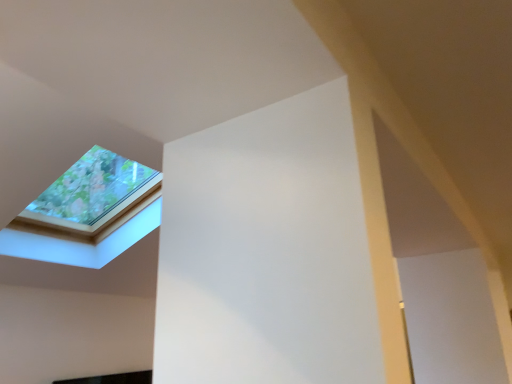
In order to face clear glass window at upper left, should I rotate leftwards or rightwards?

It's best to rotate left around 21.228 degrees.

At what (x,y) coordinates should I click in order to perform the action: click on clear glass window at upper left. Please return your answer as a coordinate pair (x, y). Looking at the image, I should click on (88, 213).

This screenshot has height=384, width=512. What do you see at coordinates (88, 213) in the screenshot?
I see `clear glass window at upper left` at bounding box center [88, 213].

The height and width of the screenshot is (384, 512). I want to click on clear glass window at upper left, so click(x=88, y=213).